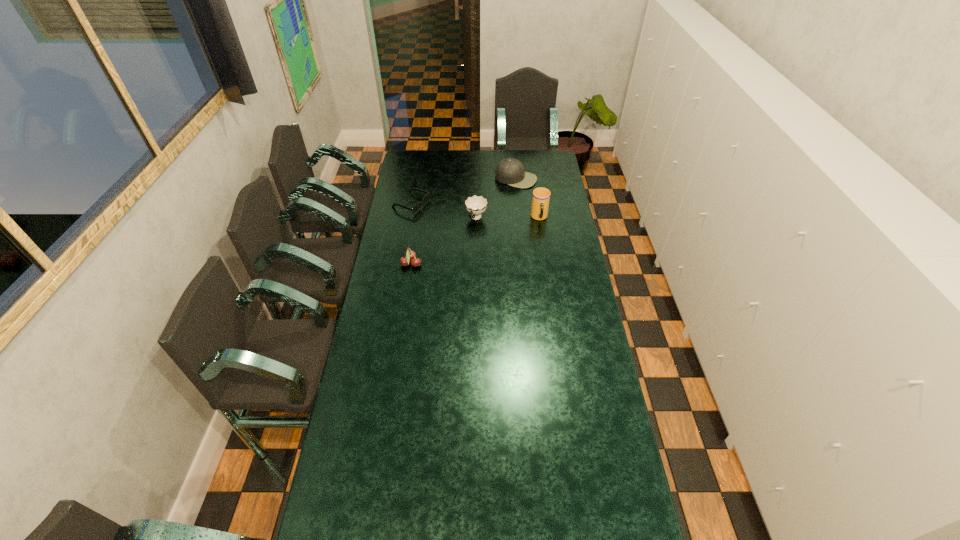
At what (x,y) coordinates should I click in order to perform the action: click on the nearest object. Please return your answer as a coordinate pair (x, y). The height and width of the screenshot is (540, 960). Looking at the image, I should click on (410, 255).

What are the coordinates of `the taller cup` in the screenshot? It's located at (541, 196).

Locate an element on the screen. the right cup is located at coordinates (541, 196).

Locate an element on the screen. The height and width of the screenshot is (540, 960). cap is located at coordinates (511, 171).

You are a GUI agent. You are given a task and a screenshot of the screen. Output one action in this format:
    pyautogui.click(x=<x>, y=<y>)
    Task: Click on the shorter cup
    This screenshot has height=540, width=960.
    Given the screenshot: What is the action you would take?
    pyautogui.click(x=475, y=205)

Locate an element on the screen. The image size is (960, 540). the left cup is located at coordinates (475, 205).

The image size is (960, 540). Find the location of `the shortest object`. the shortest object is located at coordinates (426, 198).

This screenshot has width=960, height=540. In order to click on vacant space located 0.190m on the leaves of the nearest object in this screenshot , I will do `click(464, 264)`.

Where is `vacant region located 0.260m on the side of the taller cup with the handle`? This screenshot has height=540, width=960. vacant region located 0.260m on the side of the taller cup with the handle is located at coordinates (546, 261).

At what (x,y) coordinates should I click in order to perform the action: click on blank space located on the brim of the farthest object. Please return your answer as a coordinate pair (x, y). The height and width of the screenshot is (540, 960). Looking at the image, I should click on (504, 195).